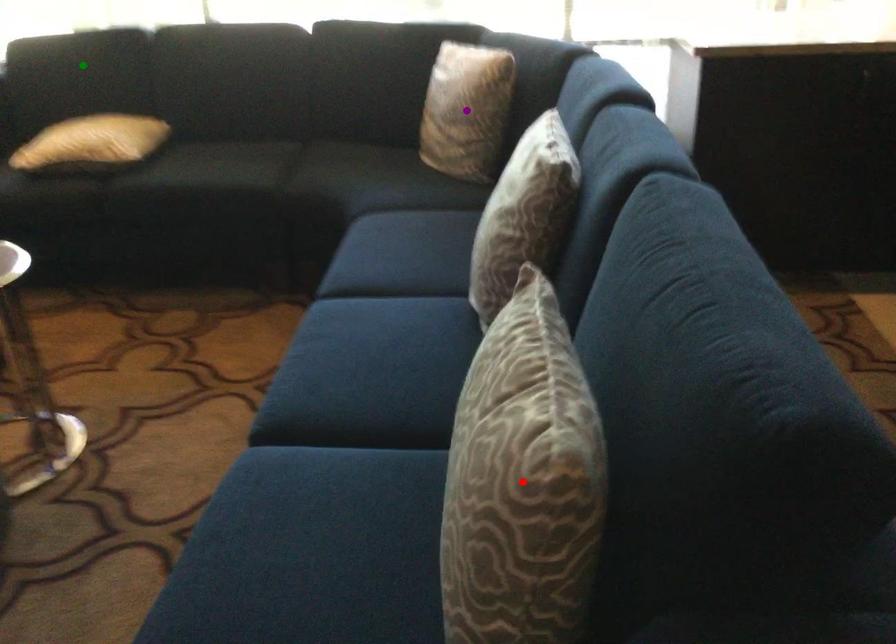
Order these from nearest to farthest:
A) green point
B) red point
C) purple point

1. red point
2. purple point
3. green point